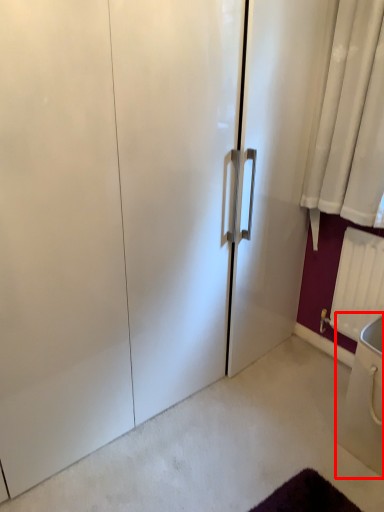
Question: In this image, where is sink (annotated by the red box) located relative to radiator?

Choices:
 (A) right
 (B) left

Answer: (A)